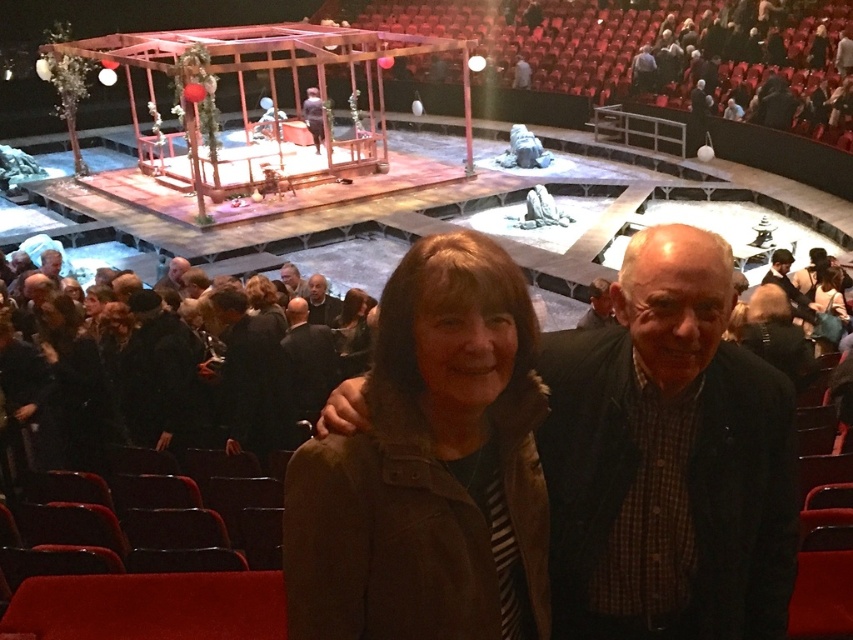
Which is behind, point (666, 554) or point (264, 284)?

The point (264, 284) is more distant.

Who is taller, dark brown textured jacket at center or dark brown hair at center?

dark brown textured jacket at center is taller.

Which is in front, point (708, 502) or point (276, 323)?

Point (708, 502)

Where is `dark brown textured jacket at center`? The width and height of the screenshot is (853, 640). dark brown textured jacket at center is located at coordinates (668, 460).

Between point (492, 520) and point (776, 260), which one is positioned in front?

Positioned in front is point (492, 520).

Is brown leather jacket at lower center shorter than dark brown leather jacket at upper right?

No.

This screenshot has height=640, width=853. In order to click on brown leather jacket at lower center in this screenshot , I will do `click(428, 467)`.

The image size is (853, 640). I want to click on brown leather jacket at lower center, so click(x=428, y=467).

Between point (828, 340) and point (294, 292), which one is positioned in front?

Positioned in front is point (828, 340).

Which is behind, point (827, 342) or point (299, 292)?

The point (299, 292) is behind.

Does point (836, 301) lie behind point (289, 268)?

No, it is in front of (289, 268).

This screenshot has width=853, height=640. In order to click on matte black jacket at lower right in this screenshot , I will do `click(828, 307)`.